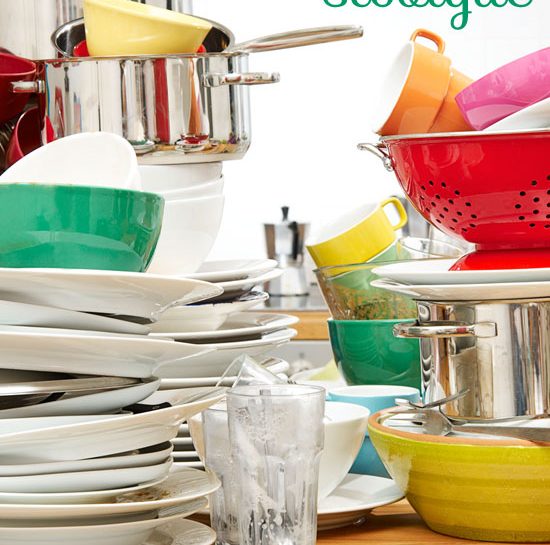
If there are any how many clear glass items are in this picture? present in the image, indicate their positions. Your answer should be formatted as a list of tuples, i.e. [(x1, y1), (x2, y2), ...], where each tuple contains the x and y coordinates of a point satisfying the conditions above.

[(286, 404), (212, 422), (249, 370), (415, 251), (351, 299)]